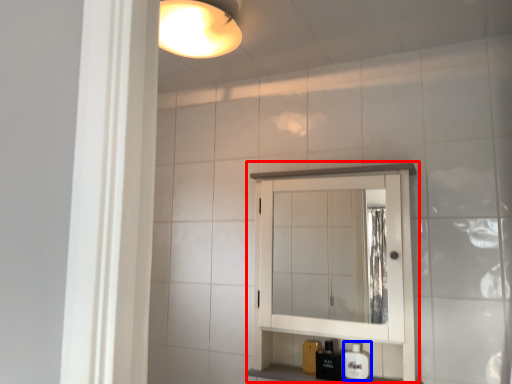
Question: Which object is closer to the camera taking this photo, medicine cabinet (highlighted by a red box) or soap dispenser (highlighted by a blue box)?

Choices:
 (A) medicine cabinet
 (B) soap dispenser

Answer: (A)